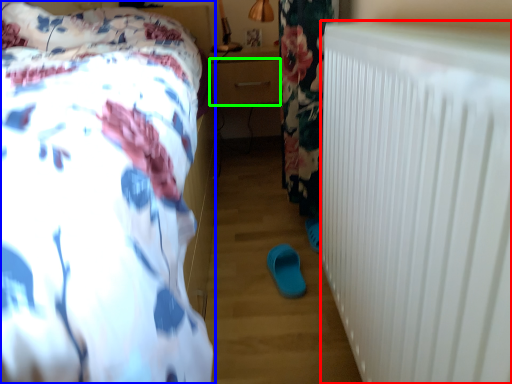
Question: Based on their relative distances, which object is nearer to radiator (highlighted by a red box)? Choose from bed (highlighted by a blue box) and drawer (highlighted by a green box).

Choices:
 (A) bed
 (B) drawer

Answer: (A)